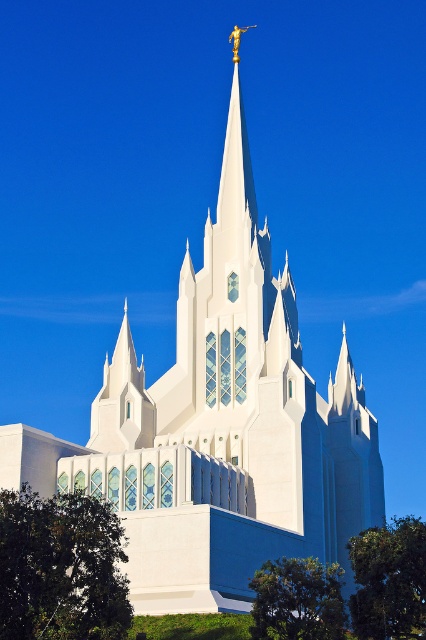
Looking at this image, is green leafy tree at lower right wider than green leafy tree at lower center?

Yes, green leafy tree at lower right is wider than green leafy tree at lower center.

How much distance is there between green leafy tree at lower right and green leafy tree at lower center?

green leafy tree at lower right and green leafy tree at lower center are 7.95 meters apart from each other.

Who is more distant from viewer, (379, 577) or (267, 605)?

Point (267, 605)

Find the location of a particular element. green leafy tree at lower right is located at coordinates coord(388,580).

Does point (58, 524) come farther from viewer compared to point (314, 634)?

That is False.

Can you confirm if green leafy tree at lower left is positioned above green leafy tree at lower center?

Indeed, green leafy tree at lower left is positioned over green leafy tree at lower center.

Between point (19, 630) and point (339, 605), which one is positioned behind?

Positioned behind is point (339, 605).

Identify the location of green leafy tree at lower left. (60, 568).

Between green leafy tree at lower left and green leafy tree at lower right, which one has less height?

Standing shorter between the two is green leafy tree at lower left.

Is green leafy tree at lower left closer to camera compared to green leafy tree at lower right?

Yes.

Between point (37, 573) and point (379, 554), which one is positioned in front?

Point (37, 573) is in front.

Where is `green leafy tree at lower left`? green leafy tree at lower left is located at coordinates (60, 568).